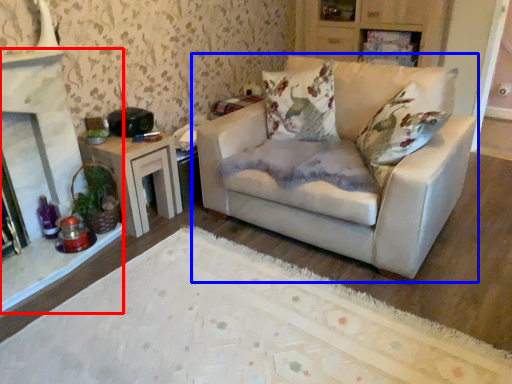
Question: Which object appears farthest to the camera in this image, fireplace (highlighted by a red box) or studio couch (highlighted by a blue box)?

Choices:
 (A) fireplace
 (B) studio couch

Answer: (A)